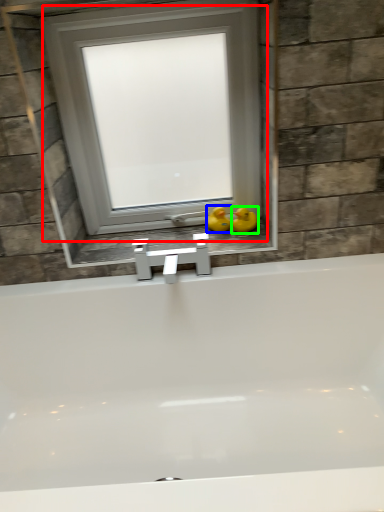
Question: Which object is positioned closest to window (highlighted by a red box)? Select from duck (highlighted by a blue box) and duck (highlighted by a green box).

Choices:
 (A) duck
 (B) duck

Answer: (A)